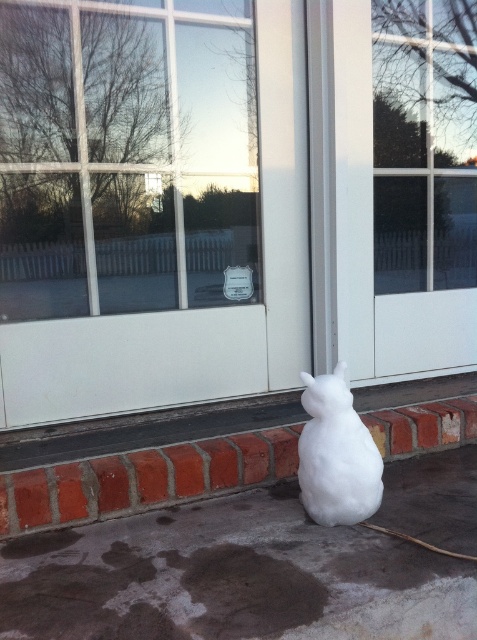
Question: Which object is the farthest from the white matte rabbit at lower center?

Choices:
 (A) white matte screen door at upper right
 (B) transparent glass door at center

Answer: (B)

Question: Can you confirm if transparent glass door at center is positioned to the left of white matte screen door at upper right?

Choices:
 (A) yes
 (B) no

Answer: (A)

Question: Which point appears farthest from the camera in this image?

Choices:
 (A) (427, 317)
 (B) (124, 32)
 (C) (304, 474)

Answer: (A)

Question: Does transparent glass door at center have a greater width compared to white matte rabbit at lower center?

Choices:
 (A) yes
 (B) no

Answer: (A)

Question: Can you confirm if transparent glass door at center is positioned to the left of white matte rabbit at lower center?

Choices:
 (A) no
 (B) yes

Answer: (B)

Question: Which of the following is the farthest from the observer?

Choices:
 (A) (334, 465)
 (B) (349, 198)
 (C) (186, 166)

Answer: (B)